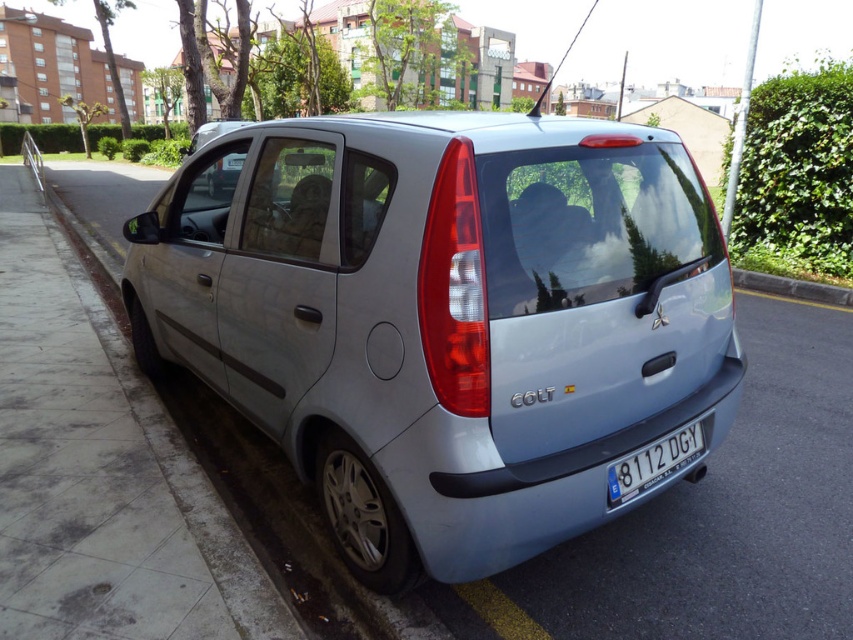
Question: Can you confirm if satin silver car at center is smaller than white plastic license plate at center?

Choices:
 (A) no
 (B) yes

Answer: (A)

Question: Which point is closer to the camera?

Choices:
 (A) satin silver car at center
 (B) white plastic license plate at center

Answer: (A)

Question: Does satin silver car at center have a greater width compared to white plastic license plate at center?

Choices:
 (A) yes
 (B) no

Answer: (A)

Question: Does satin silver car at center have a smaller size compared to white plastic license plate at center?

Choices:
 (A) yes
 (B) no

Answer: (B)

Question: Among these objects, which one is nearest to the camera?

Choices:
 (A) satin silver car at center
 (B) white plastic license plate at center

Answer: (A)